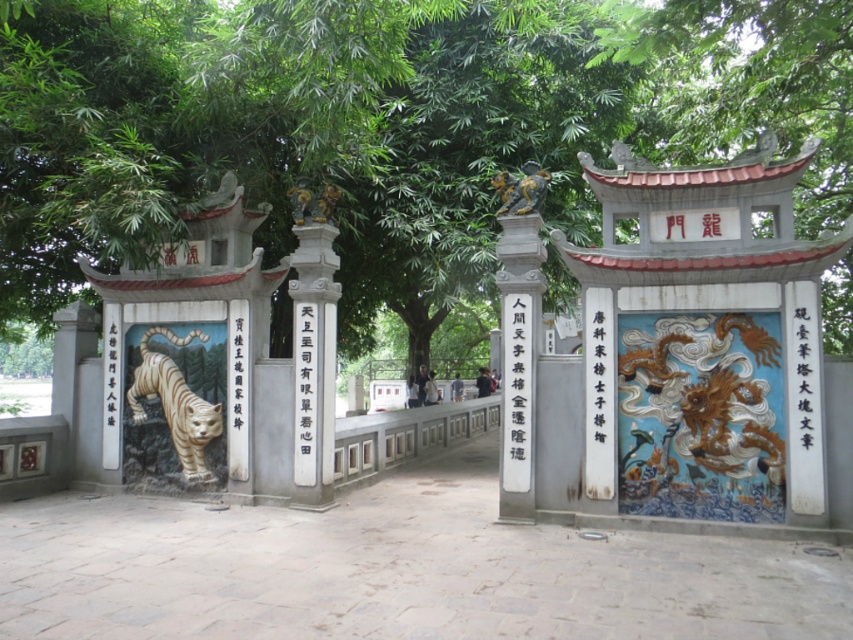
You are standing in front of the traditional Chinese gate and see two points marked on the gate. The first point is at coordinates point [839,193] and the second point is at point [325,332]. Which point is closer to the front of the gate?

Point [325,332] is closer to the front of the gate because it is in front of point [839,193].

You are standing in front of a traditional Chinese gate with intricate carvings. There is a point marked at coordinates (173, 403) on the gate. What does this point indicate?

The point at coordinates (173, 403) indicates the white glossy tiger at left.